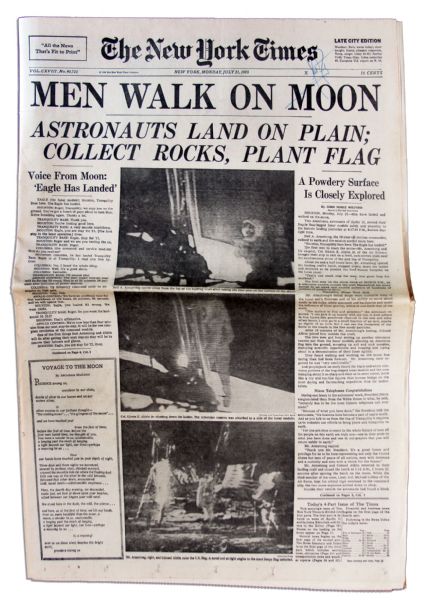
Identify the location of pictures. The height and width of the screenshot is (600, 426). (274, 369).